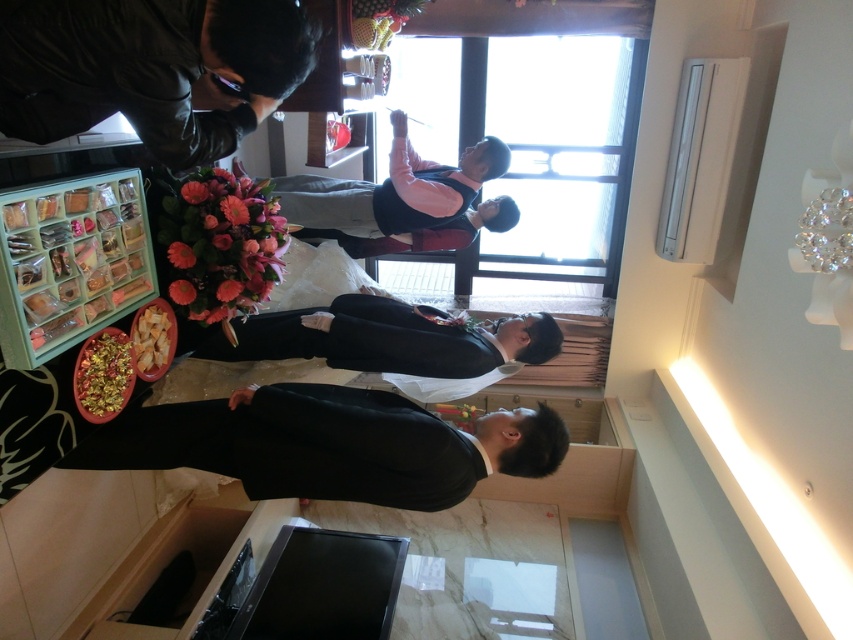
Question: Does matte black dress at center have a greater width compared to pink velvet dress at center?

Choices:
 (A) no
 (B) yes

Answer: (B)

Question: From the image, what is the correct spatial relationship of black satin suit at lower center in relation to golden textured chips at lower left?

Choices:
 (A) left
 (B) right

Answer: (B)

Question: Which of the following is the farthest from the observer?

Choices:
 (A) (375, 353)
 (B) (283, 196)
 (C) (100, 385)
 (D) (138, 360)

Answer: (B)

Question: Which point is farther to the camera?

Choices:
 (A) pyautogui.click(x=131, y=326)
 (B) pyautogui.click(x=450, y=340)
 (C) pyautogui.click(x=96, y=420)
 (D) pyautogui.click(x=386, y=227)

Answer: (D)

Question: Estimate the real-world distances between objects in this image. Which object is closer to the golden textured chips at lower left?

Choices:
 (A) matte black dress at center
 (B) dark green jacket at upper left

Answer: (A)

Question: Can you confirm if dark green jacket at upper left is thinner than matte black dress at center?

Choices:
 (A) no
 (B) yes

Answer: (B)